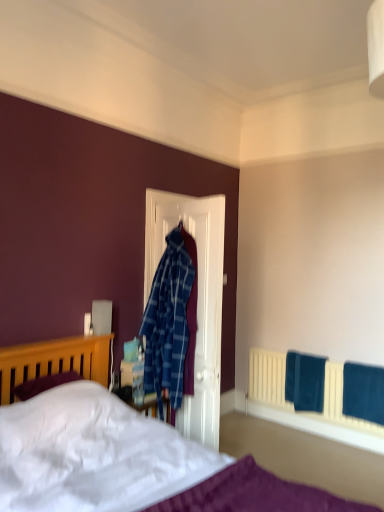
Where is `velvet blue bath towel at lower right, the second bath towel positioned from the back`? velvet blue bath towel at lower right, the second bath towel positioned from the back is located at coordinates (363, 392).

This screenshot has height=512, width=384. Describe the element at coordinates (363, 392) in the screenshot. I see `velvet blue bath towel at lower right, the second bath towel positioned from the back` at that location.

Based on the photo, measure the distance between point (32, 356) and camera.

8.24 feet.

The height and width of the screenshot is (512, 384). I want to click on velvet blue bath towel at lower right, which is the 1th bath towel in front-to-back order, so click(x=363, y=392).

Is velvet blue bath towel at lower right, which is the 1th bath towel in front-to-back order, placed right next to white soft bed at lower left?

No.

Is velvet blue bath towel at lower right, which is the 1th bath towel in front-to-back order, turned away from white soft bed at lower left?

No, white soft bed at lower left is not at the back of velvet blue bath towel at lower right, which is the 1th bath towel in front-to-back order.

Which object is further away from the camera, velvet blue bath towel at lower right, which is the 1th bath towel in front-to-back order, or white soft bed at lower left?

velvet blue bath towel at lower right, which is the 1th bath towel in front-to-back order, is more distant.

Which is more to the right, velvet blue bath towel at lower right, positioned as the second bath towel in left-to-right order, or white soft bed at lower left?

velvet blue bath towel at lower right, positioned as the second bath towel in left-to-right order, is more to the right.

From a real-world perspective, which object rests below the other?

velvet blue bath towel at lower right, the second bath towel positioned from the back, from a real-world perspective.

This screenshot has width=384, height=512. Find the location of `bed to the left of velvet blue bath towel at lower right, positioned as the second bath towel in left-to-right order`. bed to the left of velvet blue bath towel at lower right, positioned as the second bath towel in left-to-right order is located at coordinates (303, 432).

Is white soft bed at lower left facing away from velvet blue bath towel at lower right, positioned as the second bath towel in left-to-right order?

No, white soft bed at lower left is not facing the opposite direction of velvet blue bath towel at lower right, positioned as the second bath towel in left-to-right order.

Looking at this image, between white soft bed at lower left and velvet blue bath towel at lower right, the second bath towel positioned from the back, which one appears on the left side from the viewer's perspective?

white soft bed at lower left is more to the left.

Measure the distance between teal fabric towel at lower right, marked as the first bath towel in a left-to-right arrangement, and velvet blue bath towel at lower right, positioned as the second bath towel in left-to-right order.

teal fabric towel at lower right, marked as the first bath towel in a left-to-right arrangement, and velvet blue bath towel at lower right, positioned as the second bath towel in left-to-right order, are 34.30 centimeters apart.

Is velvet blue bath towel at lower right, positioned as the second bath towel in left-to-right order, completely or partially inside teal fabric towel at lower right, marked as the first bath towel in a left-to-right arrangement?

No.

From the image's perspective, between teal fabric towel at lower right, marked as the 1th bath towel in a back-to-front arrangement, and velvet blue bath towel at lower right, positioned as the second bath towel in left-to-right order, who is located below?

velvet blue bath towel at lower right, positioned as the second bath towel in left-to-right order, is shown below in the image.

Looking at their sizes, would you say teal fabric towel at lower right, marked as the 1th bath towel in a back-to-front arrangement, is wider or thinner than velvet blue bath towel at lower right, the second bath towel positioned from the back?

Considering their sizes, teal fabric towel at lower right, marked as the 1th bath towel in a back-to-front arrangement, looks slimmer than velvet blue bath towel at lower right, the second bath towel positioned from the back.

From the image's perspective, between velvet blue bath towel at lower right, the second bath towel positioned from the back, and teal fabric towel at lower right, marked as the first bath towel in a left-to-right arrangement, who is located below?

velvet blue bath towel at lower right, the second bath towel positioned from the back, from the image's perspective.

From the picture: In terms of height, does velvet blue bath towel at lower right, which is the first bath towel from right to left, look taller or shorter compared to teal fabric towel at lower right, positioned as the 2th bath towel in front-to-back order?

Clearly, velvet blue bath towel at lower right, which is the first bath towel from right to left, is taller compared to teal fabric towel at lower right, positioned as the 2th bath towel in front-to-back order.

Is point (369, 418) positioned in front of point (302, 376)?

Yes, point (369, 418) is in front of point (302, 376).

From the picture: Does teal fabric towel at lower right, positioned as the 2th bath towel in front-to-back order, contain white soft bed at lower left?

No, teal fabric towel at lower right, positioned as the 2th bath towel in front-to-back order, does not contain white soft bed at lower left.

Can you tell me how much teal fabric towel at lower right, the second bath towel in the right-to-left sequence, and white soft bed at lower left differ in facing direction?

90 degrees separate the facing orientations of teal fabric towel at lower right, the second bath towel in the right-to-left sequence, and white soft bed at lower left.

Which object is positioned more to the left, teal fabric towel at lower right, marked as the first bath towel in a left-to-right arrangement, or white soft bed at lower left?

Positioned to the left is white soft bed at lower left.

Looking at this image, which of these two, white soft bed at lower left or teal fabric towel at lower right, the second bath towel in the right-to-left sequence, stands taller?

Standing taller between the two is white soft bed at lower left.

Looking at their sizes, would you say white soft bed at lower left is wider or thinner than teal fabric towel at lower right, marked as the first bath towel in a left-to-right arrangement?

In the image, white soft bed at lower left appears to be wider than teal fabric towel at lower right, marked as the first bath towel in a left-to-right arrangement.

Relative to teal fabric towel at lower right, marked as the first bath towel in a left-to-right arrangement, is white soft bed at lower left in front or behind?

white soft bed at lower left is positioned closer to the viewer than teal fabric towel at lower right, marked as the first bath towel in a left-to-right arrangement.

The width and height of the screenshot is (384, 512). Find the location of `bed located in front of the teal fabric towel at lower right, marked as the 1th bath towel in a back-to-front arrangement`. bed located in front of the teal fabric towel at lower right, marked as the 1th bath towel in a back-to-front arrangement is located at coordinates (303, 432).

This screenshot has height=512, width=384. Find the location of `bath towel that is the 2nd one when counting rightward from the white soft bed at lower left`. bath towel that is the 2nd one when counting rightward from the white soft bed at lower left is located at coordinates (363, 392).

In the image, there is a velvet blue bath towel at lower right, the second bath towel positioned from the back. Identify the location of bed above it (from the image's perspective). The height and width of the screenshot is (512, 384). 303,432.

Considering their positions, is white soft bed at lower left positioned closer to teal fabric towel at lower right, marked as the 1th bath towel in a back-to-front arrangement, than velvet blue bath towel at lower right, which is the first bath towel from right to left?

white soft bed at lower left lies closer to teal fabric towel at lower right, marked as the 1th bath towel in a back-to-front arrangement, than the other object.

Based on their spatial positions, is velvet blue bath towel at lower right, the second bath towel positioned from the back, or teal fabric towel at lower right, marked as the first bath towel in a left-to-right arrangement, further from white soft bed at lower left?

Among the two, velvet blue bath towel at lower right, the second bath towel positioned from the back, is located further to white soft bed at lower left.

Which object lies nearer to the anchor point velvet blue bath towel at lower right, the second bath towel positioned from the back, teal fabric towel at lower right, marked as the first bath towel in a left-to-right arrangement, or white soft bed at lower left?

white soft bed at lower left is positioned closer to the anchor velvet blue bath towel at lower right, the second bath towel positioned from the back.

Based on their spatial positions, is teal fabric towel at lower right, marked as the first bath towel in a left-to-right arrangement, or velvet blue bath towel at lower right, positioned as the second bath towel in left-to-right order, closer to white soft bed at lower left?

Based on the image, teal fabric towel at lower right, marked as the first bath towel in a left-to-right arrangement, appears to be nearer to white soft bed at lower left.

Estimate the real-world distances between objects in this image. Which object is further from teal fabric towel at lower right, marked as the 1th bath towel in a back-to-front arrangement, velvet blue bath towel at lower right, the second bath towel positioned from the back, or white soft bed at lower left?

The object further to teal fabric towel at lower right, marked as the 1th bath towel in a back-to-front arrangement, is velvet blue bath towel at lower right, the second bath towel positioned from the back.

Which object lies nearer to the anchor point velvet blue bath towel at lower right, positioned as the second bath towel in left-to-right order, white soft bed at lower left or teal fabric towel at lower right, marked as the first bath towel in a left-to-right arrangement?

The object closer to velvet blue bath towel at lower right, positioned as the second bath towel in left-to-right order, is white soft bed at lower left.

Where is `bath towel between white soft bed at lower left and teal fabric towel at lower right, marked as the first bath towel in a left-to-right arrangement, along the z-axis`? bath towel between white soft bed at lower left and teal fabric towel at lower right, marked as the first bath towel in a left-to-right arrangement, along the z-axis is located at coordinates (363, 392).